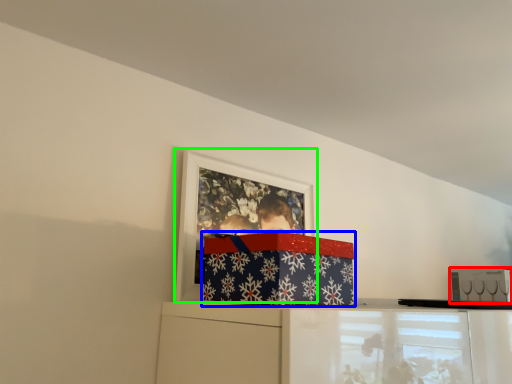
Question: Which object is the closest to the box (highlighted by a red box)? Choose among these: package (highlighted by a blue box) or picture frame (highlighted by a green box).

Choices:
 (A) package
 (B) picture frame

Answer: (B)